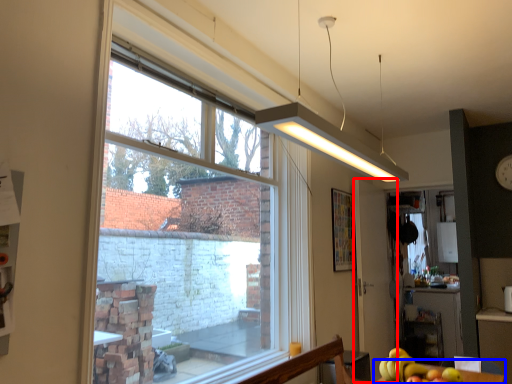
Question: Among these objects, which one is farthest to the camera, screen door (highlighted by a red box) or table (highlighted by a blue box)?

Choices:
 (A) screen door
 (B) table

Answer: (A)